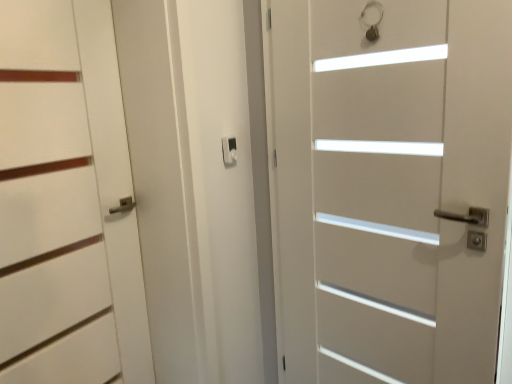
Question: Does white matte door at left, which ranks as the 1th door in left-to-right order, have a lesser width compared to white matte door at center, the first door in the right-to-left sequence?

Choices:
 (A) yes
 (B) no

Answer: (A)

Question: Does white matte door at left, positioned as the second door in right-to-left order, have a smaller size compared to white matte door at center, which is counted as the 2th door, starting from the left?

Choices:
 (A) yes
 (B) no

Answer: (A)

Question: From a real-world perspective, is white matte door at left, positioned as the second door in right-to-left order, below white matte door at center, the first door in the right-to-left sequence?

Choices:
 (A) yes
 (B) no

Answer: (B)

Question: Can you confirm if white matte door at left, positioned as the second door in right-to-left order, is taller than white matte door at center, the first door in the right-to-left sequence?

Choices:
 (A) no
 (B) yes

Answer: (A)

Question: Does white matte door at left, which ranks as the 1th door in left-to-right order, turn towards white matte door at center, the first door in the right-to-left sequence?

Choices:
 (A) no
 (B) yes

Answer: (A)

Question: Is white matte door at left, positioned as the second door in right-to-left order, closer to camera compared to white matte door at center, which is counted as the 2th door, starting from the left?

Choices:
 (A) no
 (B) yes

Answer: (A)

Question: Does white matte door at center, the first door in the right-to-left sequence, have a larger size compared to matte black latch at center?

Choices:
 (A) no
 (B) yes

Answer: (B)

Question: Is white matte door at center, which is counted as the 2th door, starting from the left, turned away from matte black latch at center?

Choices:
 (A) no
 (B) yes

Answer: (A)

Question: From the image's perspective, is white matte door at center, the first door in the right-to-left sequence, on matte black latch at center?

Choices:
 (A) yes
 (B) no

Answer: (B)

Question: Considering the relative positions of white matte door at center, which is counted as the 2th door, starting from the left, and matte black latch at center in the image provided, is white matte door at center, which is counted as the 2th door, starting from the left, in front of matte black latch at center?

Choices:
 (A) yes
 (B) no

Answer: (A)

Question: Considering the relative positions of white matte door at center, which is counted as the 2th door, starting from the left, and matte black latch at center in the image provided, is white matte door at center, which is counted as the 2th door, starting from the left, behind matte black latch at center?

Choices:
 (A) no
 (B) yes

Answer: (A)

Question: From the image's perspective, is white matte door at center, which is counted as the 2th door, starting from the left, beneath matte black latch at center?

Choices:
 (A) no
 (B) yes

Answer: (B)

Question: Is white matte door at center, the first door in the right-to-left sequence, positioned with its back to white matte door at left, positioned as the second door in right-to-left order?

Choices:
 (A) yes
 (B) no

Answer: (B)